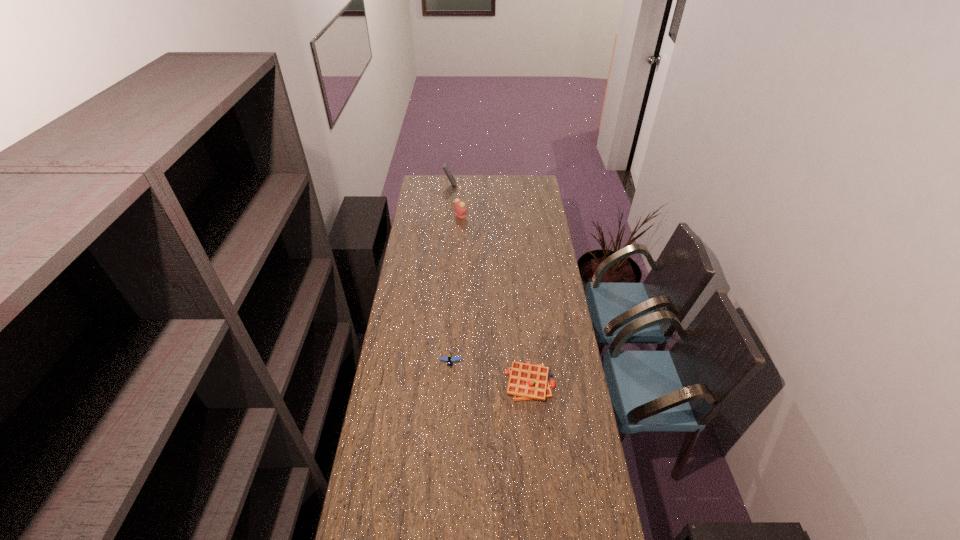
The image size is (960, 540). In order to click on empty space between the shortest object and the Lego in this screenshot , I will do `click(491, 373)`.

The height and width of the screenshot is (540, 960). What are the coordinates of `vacant space that is in between the Lego and the calculator` in the screenshot? It's located at (450, 274).

At what (x,y) coordinates should I click in order to perform the action: click on object that can be found as the second closest to the third tallest object. Please return your answer as a coordinate pair (x, y). This screenshot has width=960, height=540. Looking at the image, I should click on (460, 209).

Select which object appears as the second closest to the rightmost object. Please provide its 2D coordinates. Your answer should be formatted as a tuple, i.e. [(x, y)], where the tuple contains the x and y coordinates of a point satisfying the conditions above.

[(460, 209)]

Locate an element on the screen. free space that satisfies the following two spatial constraints: 1. on the back side of the shortest object; 2. on the front-facing side of the calculator is located at coordinates (511, 185).

Identify the location of free space in the image that satisfies the following two spatial constraints: 1. on the face of the alarm clock; 2. on the front-facing side of the third tallest object. The height and width of the screenshot is (540, 960). (452, 362).

At what (x,y) coordinates should I click in order to perform the action: click on free space that satisfies the following two spatial constraints: 1. on the back side of the waffle; 2. on the front-facing side of the tallest object. Please return your answer as a coordinate pair (x, y). Image resolution: width=960 pixels, height=540 pixels. Looking at the image, I should click on (511, 185).

Where is `vacant space that satisfies the following two spatial constraints: 1. on the face of the third shortest object; 2. on the left side of the shortest object`? The width and height of the screenshot is (960, 540). vacant space that satisfies the following two spatial constraints: 1. on the face of the third shortest object; 2. on the left side of the shortest object is located at coordinates (451, 383).

Locate an element on the screen. free point that satisfies the following two spatial constraints: 1. on the face of the third shortest object; 2. on the right side of the shortest object is located at coordinates (451, 383).

Where is `blank space that satisfies the following two spatial constraints: 1. on the front-facing side of the Lego; 2. on the right side of the rightmost object`? The image size is (960, 540). blank space that satisfies the following two spatial constraints: 1. on the front-facing side of the Lego; 2. on the right side of the rightmost object is located at coordinates (449, 383).